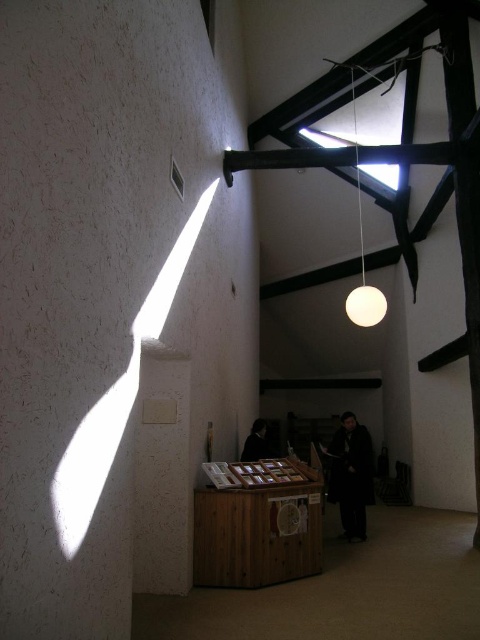
Is white textured pillar at left thinner than matte white sphere at upper center?

Yes, white textured pillar at left is thinner than matte white sphere at upper center.

Is white textured pillar at left taller than matte white sphere at upper center?

Yes, white textured pillar at left is taller than matte white sphere at upper center.

You are a GUI agent. You are given a task and a screenshot of the screen. Output one action in this format:
    pyautogui.click(x=<x>, y=<y>)
    Task: Click on the white textured pillar at left
    This screenshot has width=480, height=640.
    Given the screenshot: What is the action you would take?
    pyautogui.click(x=108, y=278)

Can you confirm if white matte sphere at upper center is wider than matte white sphere at upper center?

Incorrect, white matte sphere at upper center's width does not surpass matte white sphere at upper center's.

The height and width of the screenshot is (640, 480). I want to click on white matte sphere at upper center, so click(x=362, y=259).

Identify the location of white matte sphere at upper center. This screenshot has width=480, height=640. (362, 259).

Does dark wool coat at center have a lesser height compared to white matte sphere at upper center?

No.

Is dark wool coat at center closer to camera compared to white matte sphere at upper center?

Yes, dark wool coat at center is closer to the viewer.

This screenshot has width=480, height=640. What do you see at coordinates (350, 474) in the screenshot? I see `dark wool coat at center` at bounding box center [350, 474].

At what (x,y) coordinates should I click in order to perform the action: click on dark wool coat at center. Please return your answer as a coordinate pair (x, y). The height and width of the screenshot is (640, 480). Looking at the image, I should click on (350, 474).